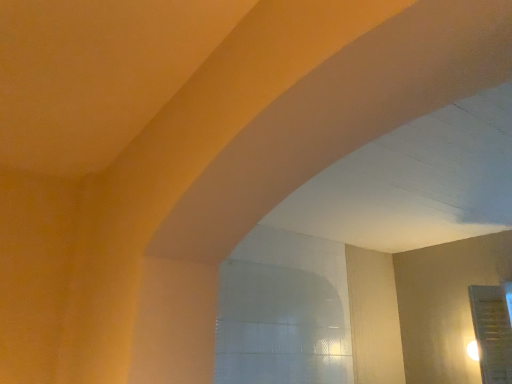
Question: Looking at their shapes, would you say clear glass window at center is wider or thinner than transparent glass door at lower right?

Choices:
 (A) thin
 (B) wide

Answer: (B)

Question: From the image's perspective, is clear glass window at center positioned above or below transparent glass door at lower right?

Choices:
 (A) below
 (B) above

Answer: (B)

Question: Do you think clear glass window at center is within transparent glass door at lower right, or outside of it?

Choices:
 (A) outside
 (B) inside

Answer: (A)

Question: Is transparent glass door at lower right spatially inside clear glass window at center, or outside of it?

Choices:
 (A) outside
 (B) inside

Answer: (A)

Question: Looking at their shapes, would you say transparent glass door at lower right is wider or thinner than clear glass window at center?

Choices:
 (A) thin
 (B) wide

Answer: (A)

Question: Is transparent glass door at lower right to the left or to the right of clear glass window at center in the image?

Choices:
 (A) right
 (B) left

Answer: (A)

Question: Is point (480, 326) positioned closer to the camera than point (250, 332)?

Choices:
 (A) farther
 (B) closer

Answer: (A)